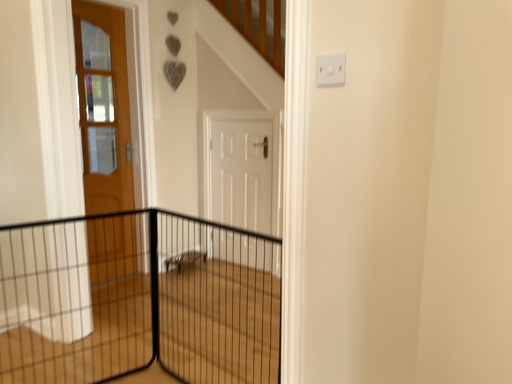
Question: Is white matte door at center, which is the first door in right-to-left order, bigger or smaller than black wire mesh fence at left?

Choices:
 (A) big
 (B) small

Answer: (B)

Question: Considering the positions of point (251, 238) and point (261, 266), is point (251, 238) closer or farther from the camera than point (261, 266)?

Choices:
 (A) closer
 (B) farther

Answer: (A)

Question: Based on their relative distances, which object is farther from the black wire mesh fence at left?

Choices:
 (A) white plastic electric outlet at upper right
 (B) matte wooden door at left, which ranks as the 1th door in left-to-right order
 (C) black wire mesh at center
 (D) white matte door at center, which is the first door in right-to-left order

Answer: (A)

Question: Which of these objects is positioned farthest from the matte wooden door at left, which ranks as the 1th door in left-to-right order?

Choices:
 (A) white plastic electric outlet at upper right
 (B) black wire mesh fence at left
 (C) white matte door at center, which is the 2th door from left to right
 (D) black wire mesh at center

Answer: (A)